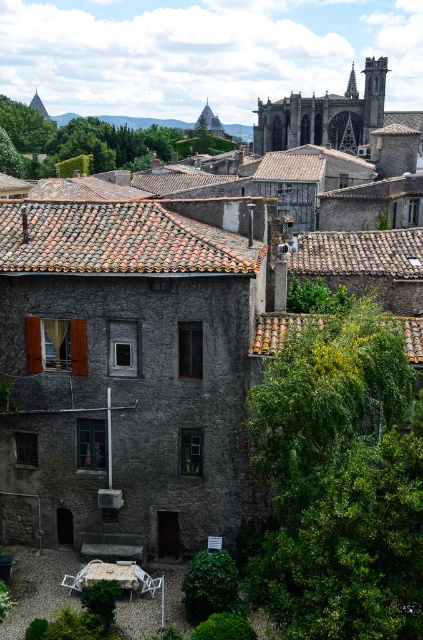
You are an urban planner analyzing the town layout. You need to determine which green leafy tree has a smaller width between the green leafy tree at lower right and the green leafy tree at upper center. Which one is it?

The green leafy tree at lower right has a smaller width compared to the green leafy tree at upper center.

You are standing at the point with coordinates point [35,140] and want to walk towards the point with coordinates point [370,342]. Which direction should you move in to get closer to the destination?

Since point [370,342] is closer to the viewer than point [35,140], you should move forward towards the direction of the destination point to get closer.